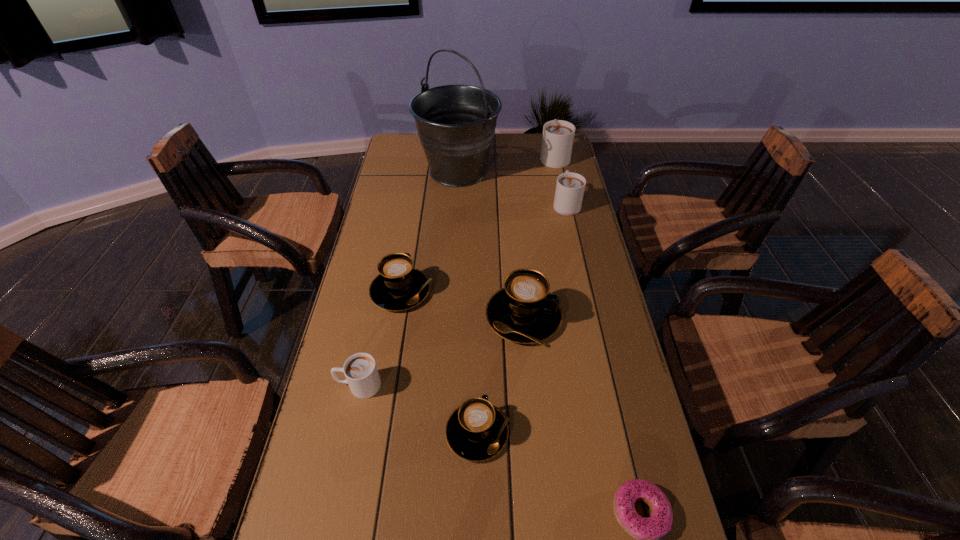
Select which white cappuccino is the second closest to the bucket. Please provide its 2D coordinates. Your answer should be formatted as a tuple, i.e. [(x, y)], where the tuple contains the x and y coordinates of a point satisfying the conditions above.

[(570, 187)]

Image resolution: width=960 pixels, height=540 pixels. What are the coordinates of `black cappuccino that is the second closest one to the farthest cappuccino` in the screenshot? It's located at (399, 286).

At what (x,y) coordinates should I click in order to perform the action: click on black cappuccino identified as the closest to the doughnut. Please return your answer as a coordinate pair (x, y). The image size is (960, 540). Looking at the image, I should click on (476, 431).

This screenshot has height=540, width=960. I want to click on vacant position in the image that satisfies the following two spatial constraints: 1. on the side with the handle of the leftmost white cappuccino; 2. on the right side of the smallest black cappuccino, so coord(348,433).

The image size is (960, 540). Find the location of `free location that satisfies the following two spatial constraints: 1. on the side with the handle of the sixth farthest object; 2. on the right side of the nearest black cappuccino`. free location that satisfies the following two spatial constraints: 1. on the side with the handle of the sixth farthest object; 2. on the right side of the nearest black cappuccino is located at coordinates (348, 433).